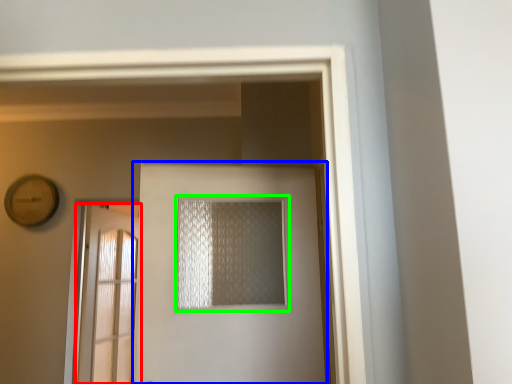
Question: Considering the real-world distances, which object is closest to door (highlighted by a red box)? door (highlighted by a blue box) or window (highlighted by a green box).

Choices:
 (A) door
 (B) window

Answer: (A)